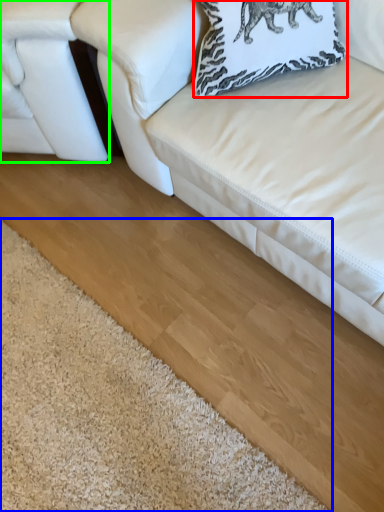
Question: Which object is the farthest from pillow (highlighted by a red box)? Choose among these: mat (highlighted by a blue box) or studio couch (highlighted by a green box).

Choices:
 (A) mat
 (B) studio couch

Answer: (A)